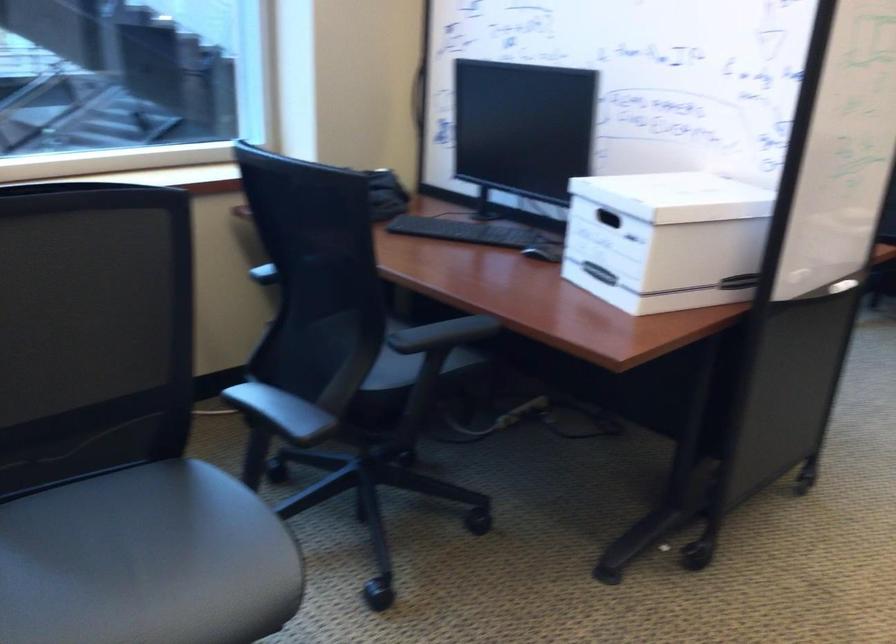
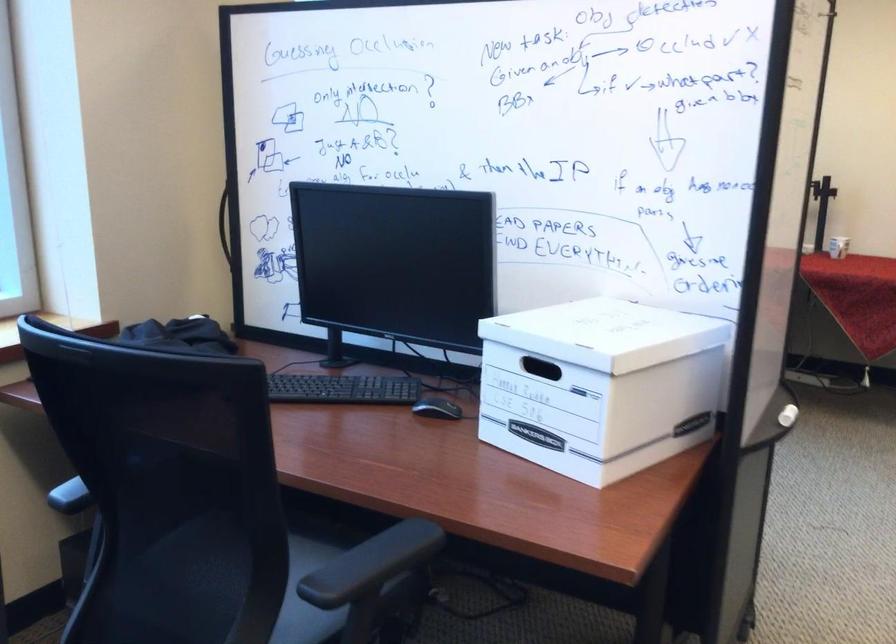
In a continuous first-person perspective shot, in which direction is the camera moving?

The movement direction of the cameraman is left, forward.